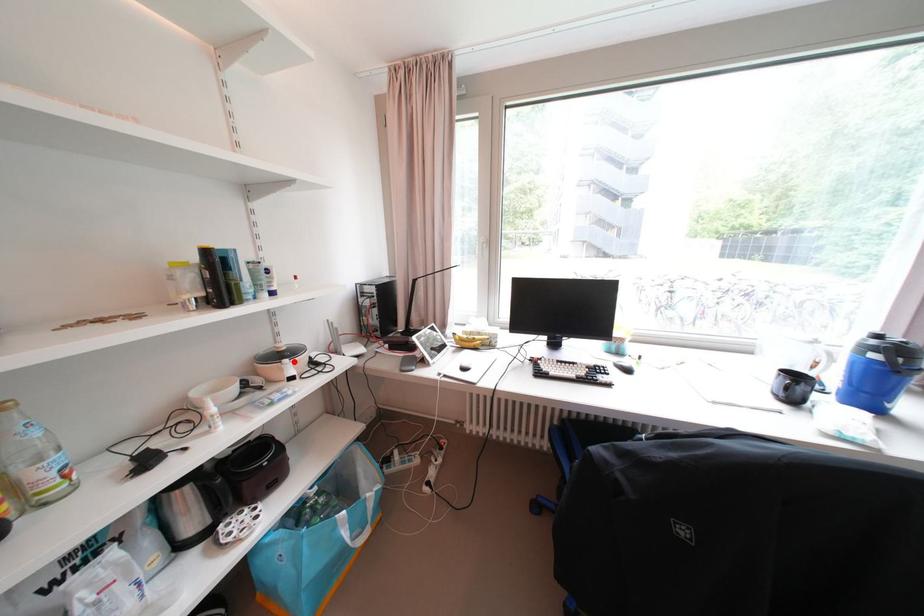
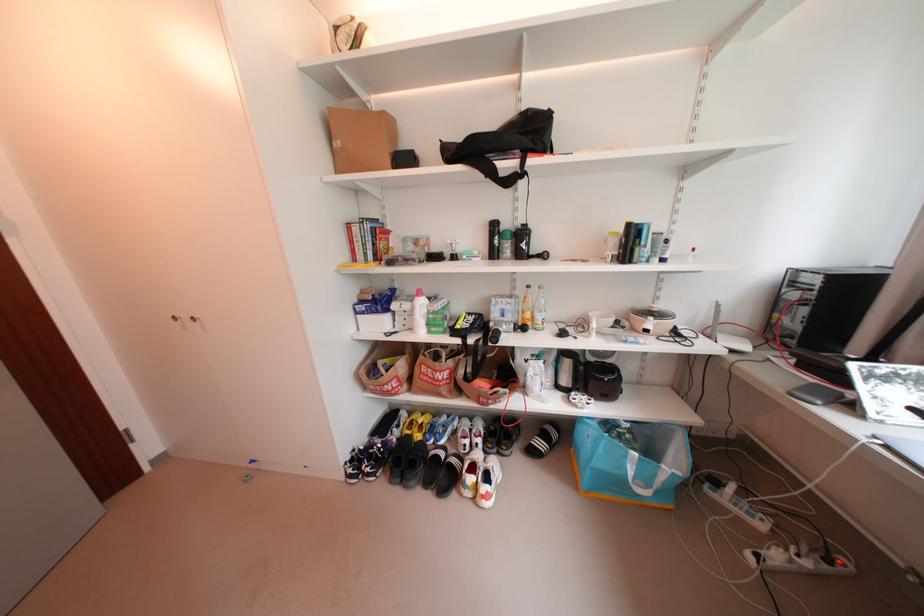
Locate, in the second image, the point that corresponds to the highlighted location in the first image.

(660, 320)